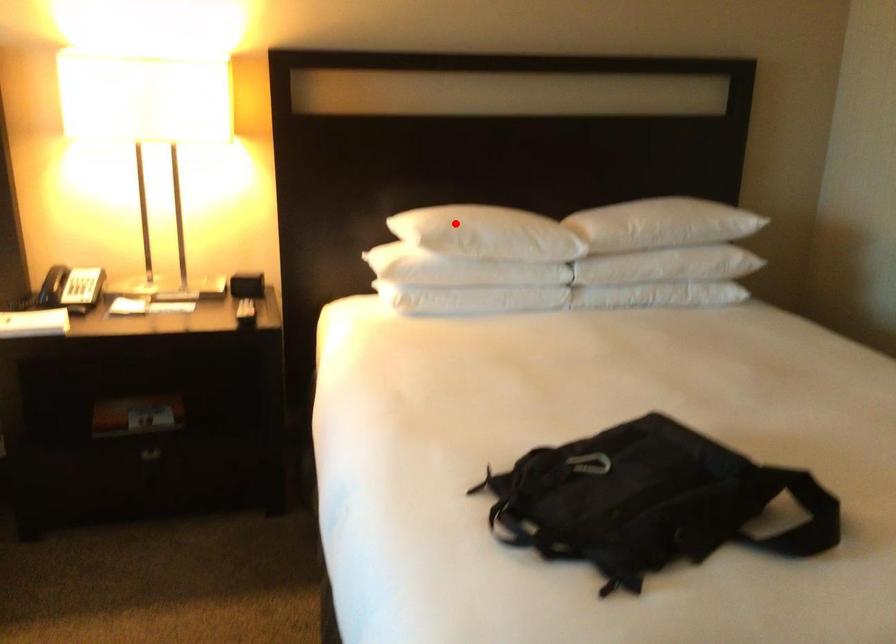
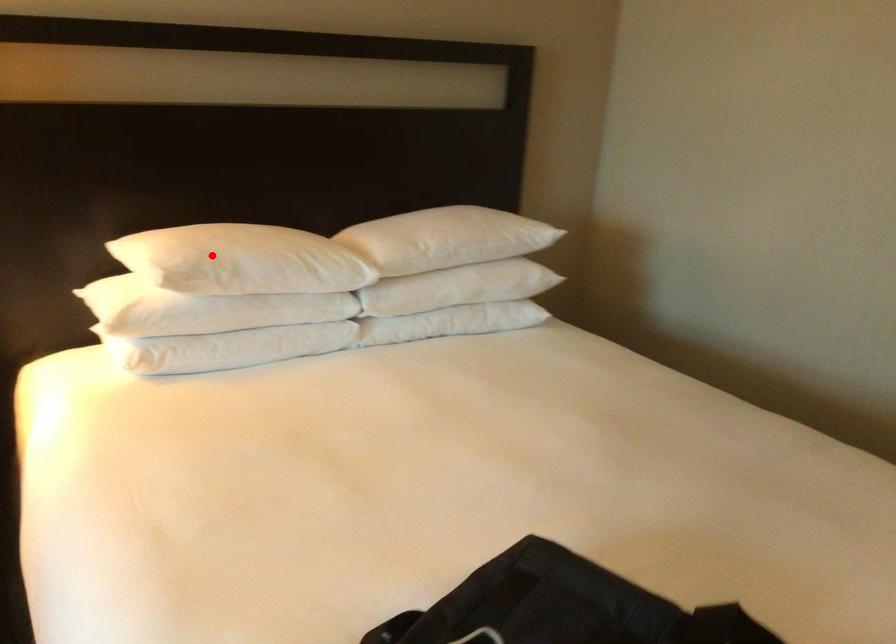
Consider the image. I am providing you with two images of the same scene from different viewpoints. A red point is marked on the first image and another point is marked on the second image. Are the points marked in image1 and image2 representing the same 3D position?

Yes